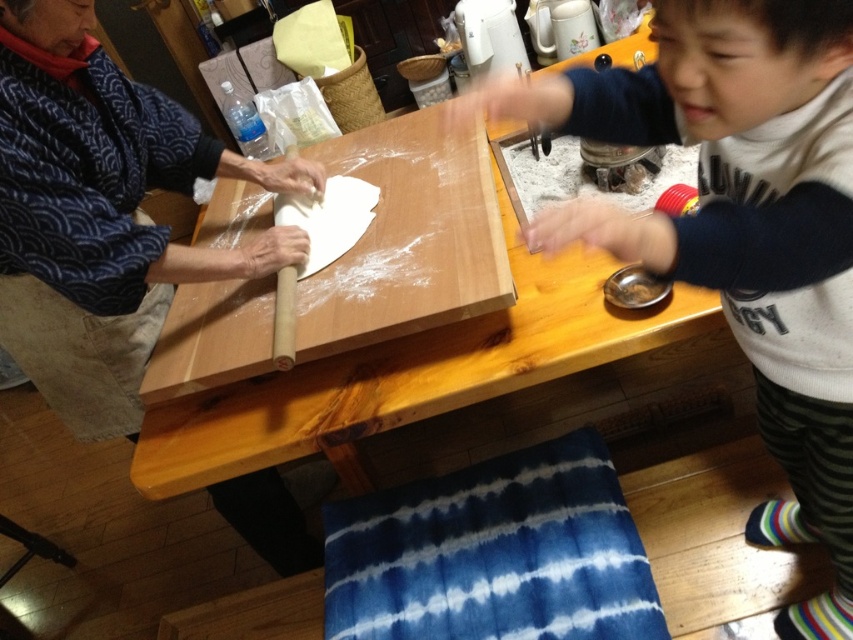
You are standing in front of the table and want to place a small bowl between the two points marked as point (793,109) and point (80,195). Which point should you place the bowl closer to if you want it to be closer to the camera?

You should place the bowl closer to point (793,109) because it is closer to the camera than point (80,195).

You are a baker who needs to ensure the rolling pin fits into a storage drawer next to the table. The drawer is exactly the same width as the white dough at center. Will the matte black rolling pin at left fit into the drawer?

The matte black rolling pin at left is wider than the white dough at center. Since the drawer matches the dough width, the rolling pin won